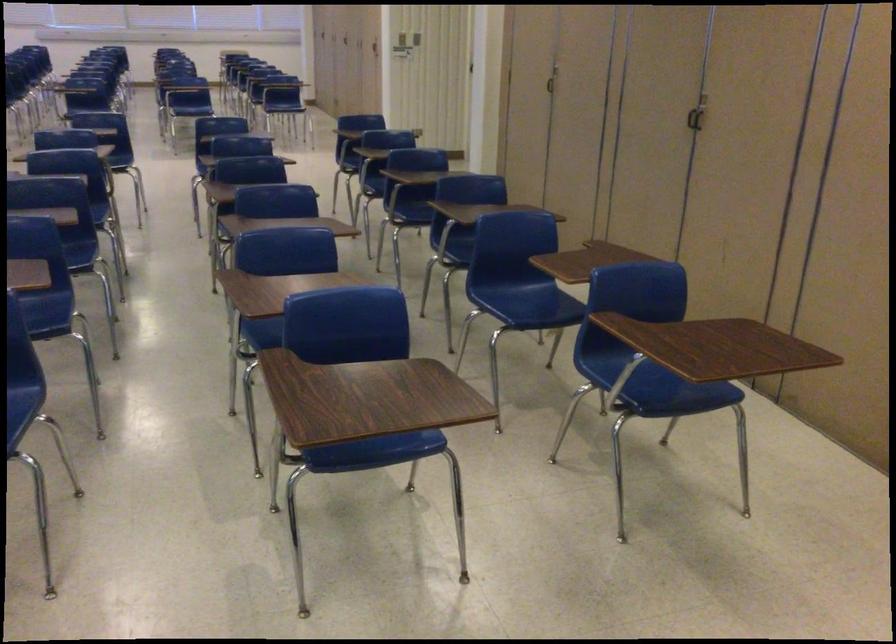
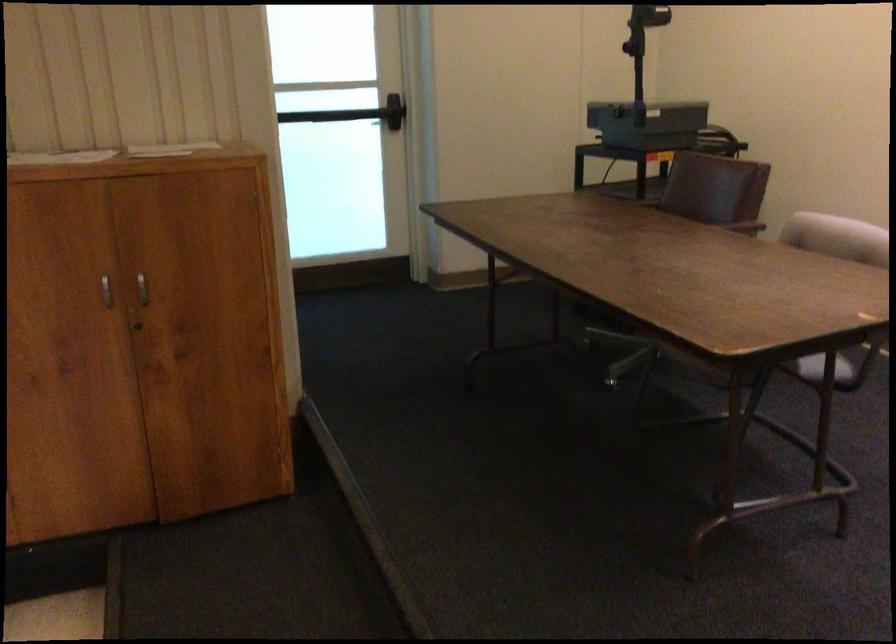
From the picture: The first image is from the beginning of the video and the second image is from the end. How did the camera likely rotate when shooting the video?

The camera rotated toward right-down.